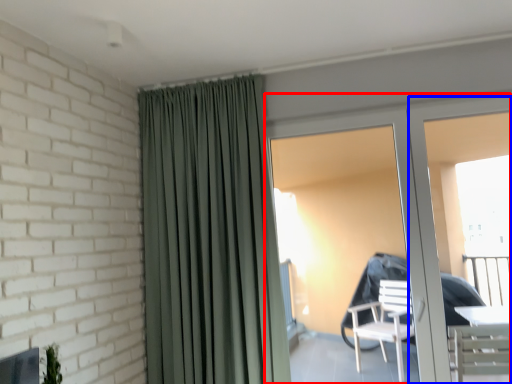
Question: Which object is closer to the camera taking this photo, door (highlighted by a red box) or screen door (highlighted by a blue box)?

Choices:
 (A) door
 (B) screen door

Answer: (A)